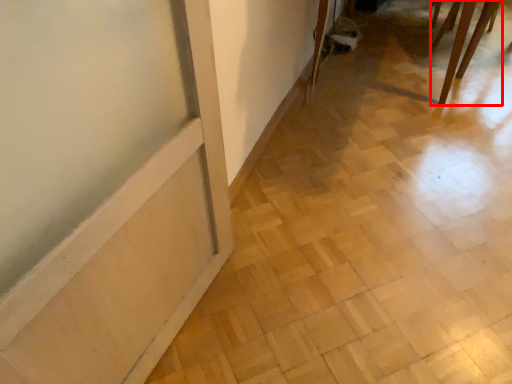
Question: In this image, where is furniture (annotated by the red box) located relative to tile?

Choices:
 (A) left
 (B) right

Answer: (B)